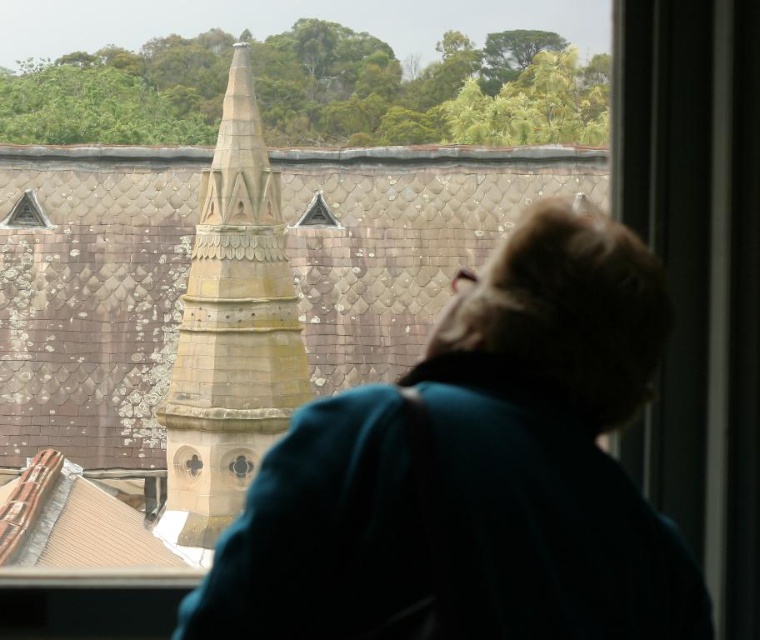
Can you confirm if teal fabric coat at center is bigger than transparent glass triangle at upper left?

Yes, teal fabric coat at center is bigger than transparent glass triangle at upper left.

Which is in front, point (521, 483) or point (30, 209)?

Point (521, 483) is in front.

The height and width of the screenshot is (640, 760). Describe the element at coordinates (475, 472) in the screenshot. I see `teal fabric coat at center` at that location.

This screenshot has height=640, width=760. Find the location of `teal fabric coat at center`. teal fabric coat at center is located at coordinates (475, 472).

Is teal fabric coat at center to the right of brown textured steeple at center from the viewer's perspective?

Yes, teal fabric coat at center is to the right of brown textured steeple at center.

Does teal fabric coat at center have a greater width compared to brown textured steeple at center?

Indeed, teal fabric coat at center has a greater width compared to brown textured steeple at center.

Identify the location of teal fabric coat at center. (475, 472).

Who is positioned more to the left, brown textured steeple at center or transparent glass triangle at upper left?

transparent glass triangle at upper left is more to the left.

Which of these two, brown textured steeple at center or transparent glass triangle at upper left, stands shorter?

Standing shorter between the two is transparent glass triangle at upper left.

Is point (280, 387) closer to camera compared to point (30, 196)?

That is True.

I want to click on brown textured steeple at center, so click(x=230, y=332).